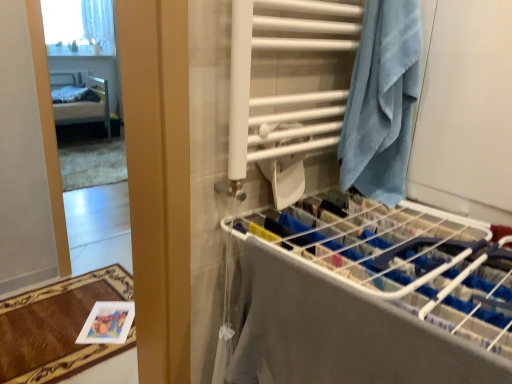
Question: From the image's perspective, is metallic silver bed at left below white sheer curtain at upper left?

Choices:
 (A) yes
 (B) no

Answer: (A)

Question: Is metallic silver bed at left in contact with white sheer curtain at upper left?

Choices:
 (A) yes
 (B) no

Answer: (B)

Question: Considering the relative sizes of metallic silver bed at left and white sheer curtain at upper left in the image provided, is metallic silver bed at left bigger than white sheer curtain at upper left?

Choices:
 (A) no
 (B) yes

Answer: (B)

Question: Considering the relative sizes of metallic silver bed at left and white sheer curtain at upper left in the image provided, is metallic silver bed at left smaller than white sheer curtain at upper left?

Choices:
 (A) no
 (B) yes

Answer: (A)

Question: Are metallic silver bed at left and white sheer curtain at upper left far apart?

Choices:
 (A) no
 (B) yes

Answer: (A)

Question: Is brown plush bath mat at lower left spatially inside white plastic drying rack at center right, or outside of it?

Choices:
 (A) inside
 (B) outside

Answer: (B)

Question: From the image's perspective, is brown plush bath mat at lower left located above or below white plastic drying rack at center right?

Choices:
 (A) above
 (B) below

Answer: (B)

Question: Based on their sizes in the image, would you say brown plush bath mat at lower left is bigger or smaller than white plastic drying rack at center right?

Choices:
 (A) big
 (B) small

Answer: (B)

Question: From their relative heights in the image, would you say brown plush bath mat at lower left is taller or shorter than white plastic drying rack at center right?

Choices:
 (A) short
 (B) tall

Answer: (A)

Question: From a real-world perspective, is white plastic drying rack at center right positioned above or below blue terry cloth towel at right?

Choices:
 (A) above
 (B) below

Answer: (B)

Question: In terms of width, does white plastic drying rack at center right look wider or thinner when compared to blue terry cloth towel at right?

Choices:
 (A) thin
 (B) wide

Answer: (B)

Question: Considering the relative positions of white plastic drying rack at center right and blue terry cloth towel at right in the image provided, is white plastic drying rack at center right to the left or to the right of blue terry cloth towel at right?

Choices:
 (A) right
 (B) left

Answer: (B)

Question: Does point (254, 158) appear closer or farther from the camera than point (399, 196)?

Choices:
 (A) farther
 (B) closer

Answer: (B)

Question: Considering the positions of point (375, 336) and point (26, 309), is point (375, 336) closer or farther from the camera than point (26, 309)?

Choices:
 (A) farther
 (B) closer

Answer: (B)

Question: In terms of size, does white plastic drying rack at center right appear bigger or smaller than brown plush bath mat at lower left?

Choices:
 (A) big
 (B) small

Answer: (A)